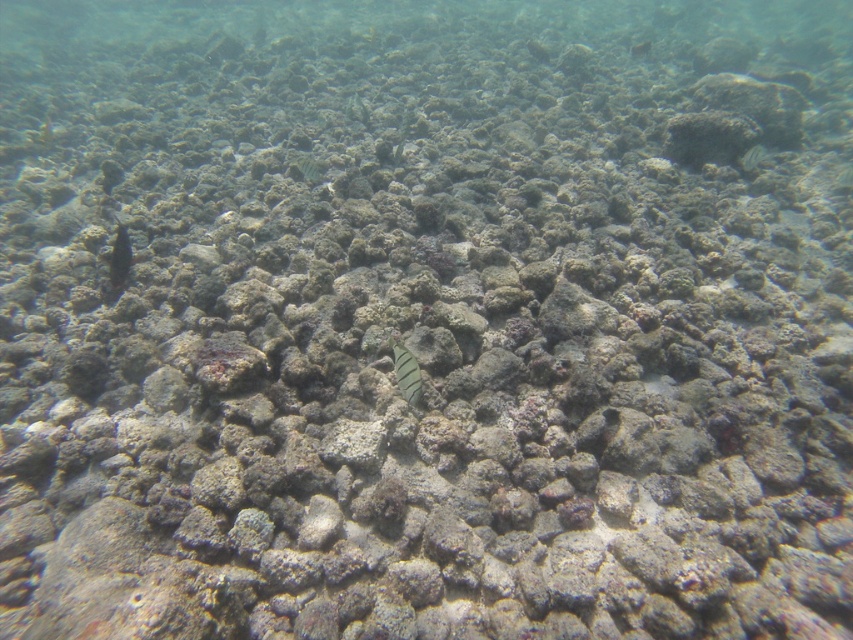
Which is below, gray striped fish at center or shiny black fish at center?

gray striped fish at center

Can you confirm if gray striped fish at center is positioned to the left of shiny black fish at center?

Incorrect, gray striped fish at center is not on the left side of shiny black fish at center.

Measure the distance between gray striped fish at center and camera.

gray striped fish at center is 1.55 meters away from camera.

Locate an element on the screen. The height and width of the screenshot is (640, 853). gray striped fish at center is located at coordinates (405, 372).

Does shiny black fish at center have a greater height compared to speckled green fish at upper right?

Indeed, shiny black fish at center has a greater height compared to speckled green fish at upper right.

Which is in front, point (119, 262) or point (757, 163)?

Point (119, 262)

This screenshot has height=640, width=853. I want to click on shiny black fish at center, so click(x=119, y=257).

Is point (415, 358) less distant than point (744, 157)?

Yes, point (415, 358) is in front of point (744, 157).

Does gray striped fish at center have a greater width compared to speckled green fish at upper right?

In fact, gray striped fish at center might be narrower than speckled green fish at upper right.

Is point (398, 355) closer to camera compared to point (753, 164)?

That is True.

I want to click on gray striped fish at center, so click(x=405, y=372).